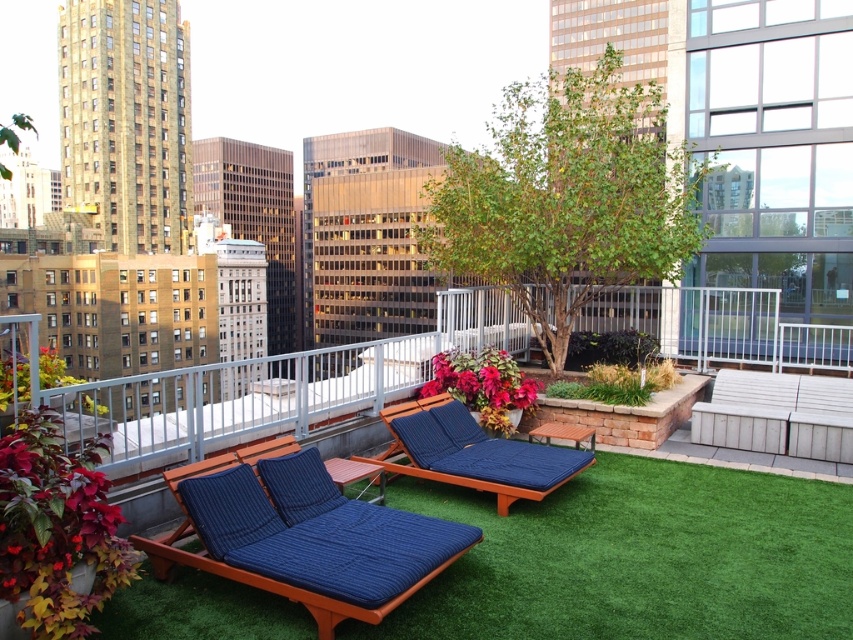
You are standing at the center of the rooftop garden and want to place a decorative statue exactly at the midpoint between the navy blue quilted cushion at center and the edge of the rooftop. What are the coordinates of that midpoint?

The midpoint between the navy blue quilted cushion at center located at point (474, 452) and the edge of the rooftop would be at coordinates (474, 546).

You are planning to place a small statue that is 1 foot tall on the green artificial turf at center. Considering the height of the matte blue cushioned lounge chair at center, will the statue be visible from behind the chair?

The green artificial turf at center is not as tall as the matte blue cushioned lounge chair at center, so the statue placed on the turf will be partially obscured by the chair and may not be fully visible from behind it.

You are designing a layout for a rooftop garden and need to place a new potted palm tree between the matte blue cushioned lounge chair at center and the white wood bench at lower right. Based on their current positions, which object should the palm tree be closer to?

The palm tree should be closer to the white wood bench at lower right because the matte blue cushioned lounge chair at center is positioned on the left side of the white wood bench at lower right, meaning the bench is to the right of the lounge chair.